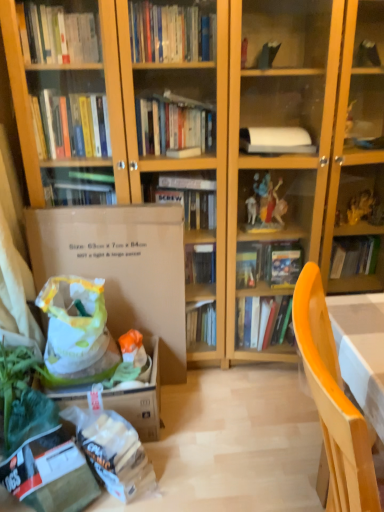
Question: From a real-world perspective, is white plastic grocery bag at lower left above or below brown cardboard box at left?

Choices:
 (A) above
 (B) below

Answer: (B)

Question: From the image's perspective, is white plastic grocery bag at lower left located above or below brown cardboard box at left?

Choices:
 (A) above
 (B) below

Answer: (B)

Question: Which of these objects is positioned farthest from the brown cardboard box at left?

Choices:
 (A) white plastic grocery bag at lower left
 (B) wooden chair at lower right

Answer: (B)

Question: Estimate the real-world distances between objects in this image. Which object is closer to the white plastic grocery bag at lower left?

Choices:
 (A) wooden chair at lower right
 (B) brown cardboard box at left

Answer: (B)